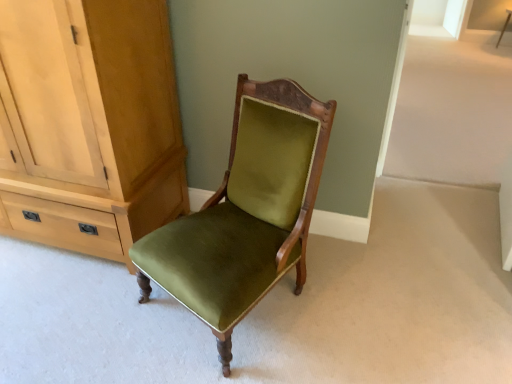
Question: From a real-world perspective, relative to matte wood cabinet at left, is velvet green chair at center vertically above or below?

Choices:
 (A) below
 (B) above

Answer: (A)

Question: In terms of height, does velvet green chair at center look taller or shorter compared to matte wood cabinet at left?

Choices:
 (A) short
 (B) tall

Answer: (A)

Question: Which object is the closest to the wooden side table at upper right?

Choices:
 (A) velvet green chair at center
 (B) matte wood cabinet at left

Answer: (A)

Question: Estimate the real-world distances between objects in this image. Which object is closer to the velvet green chair at center?

Choices:
 (A) matte wood cabinet at left
 (B) wooden side table at upper right

Answer: (A)